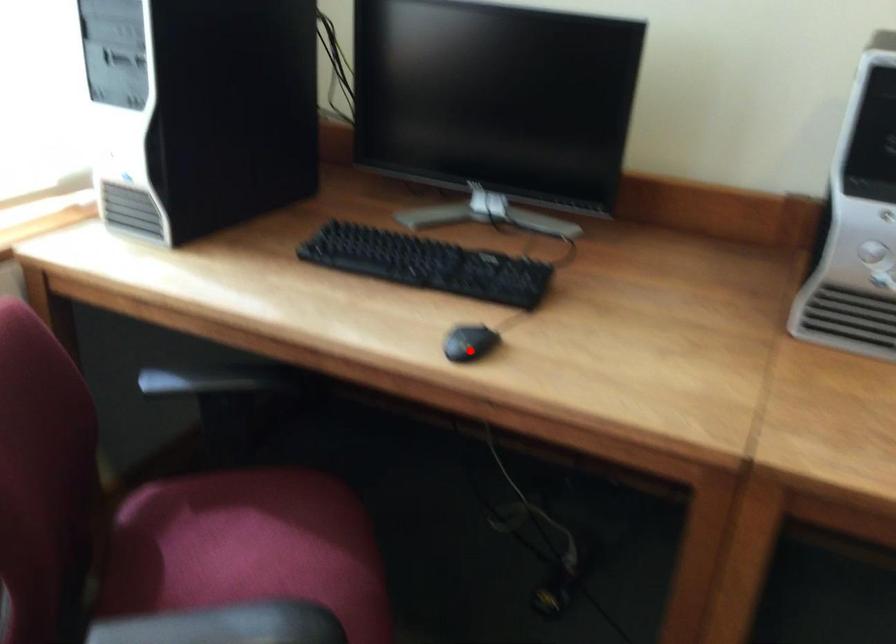
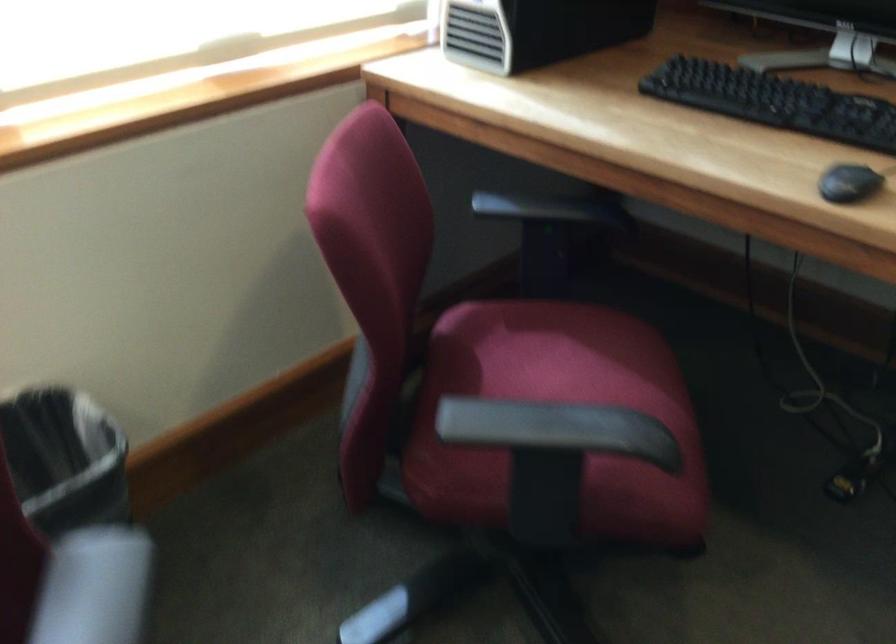
In the second image, find the point that corresponds to the highlighted location in the first image.

(848, 183)